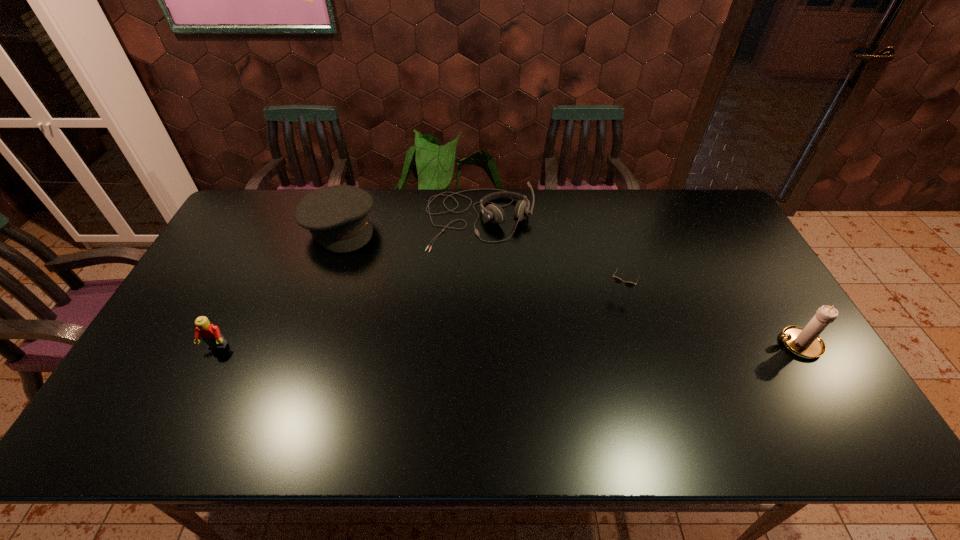
The height and width of the screenshot is (540, 960). I want to click on the second closest object to the headset, so click(x=628, y=284).

The width and height of the screenshot is (960, 540). In order to click on free spot that satisfies the following two spatial constraints: 1. on the front side of the tallest object; 2. on the handle side of the sunglasses in this screenshot , I will do `click(634, 344)`.

Image resolution: width=960 pixels, height=540 pixels. In order to click on vacant space that satisfies the following two spatial constraints: 1. on the front side of the third object from right to left; 2. on the right side of the sunglasses in this screenshot , I will do `click(479, 291)`.